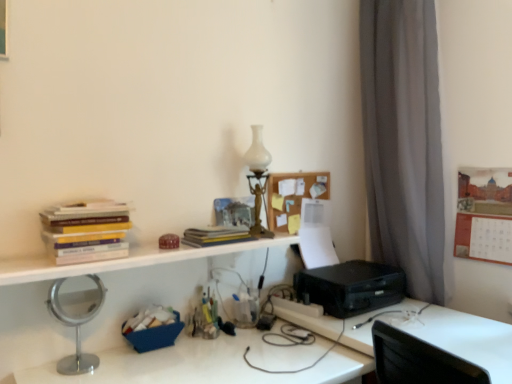
Find the location of a particular element. This screenshot has height=384, width=512. vacant space to the right of translucent plastic container at center, which is the second stationery in top-to-bottom order is located at coordinates (245, 337).